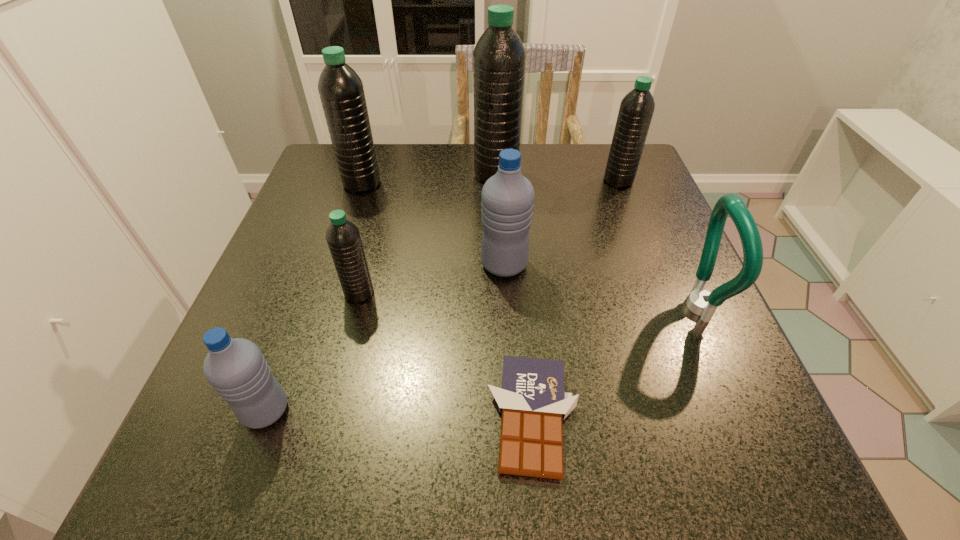
Find the location of a particular element. the tallest object is located at coordinates (499, 57).

Find the location of a particular element. the tallest water bottle is located at coordinates (499, 57).

Identify the location of the third smallest black water bottle. The image size is (960, 540). (341, 91).

Find the location of a particular element. This screenshot has width=960, height=540. the second tallest water bottle is located at coordinates (341, 91).

At what (x,y) coordinates should I click in order to perform the action: click on the rightmost black water bottle. Please return your answer as a coordinate pair (x, y). The width and height of the screenshot is (960, 540). Looking at the image, I should click on (636, 109).

The image size is (960, 540). Find the location of `the rightmost water bottle`. the rightmost water bottle is located at coordinates (636, 109).

This screenshot has height=540, width=960. What are the coordinates of `the right blue water bottle` in the screenshot? It's located at (507, 199).

Where is `the fourth farthest water bottle`? the fourth farthest water bottle is located at coordinates (507, 199).

Locate an element on the screen. green bottle opener is located at coordinates (701, 302).

The width and height of the screenshot is (960, 540). In order to click on the smallest black water bottle in this screenshot , I will do `click(343, 237)`.